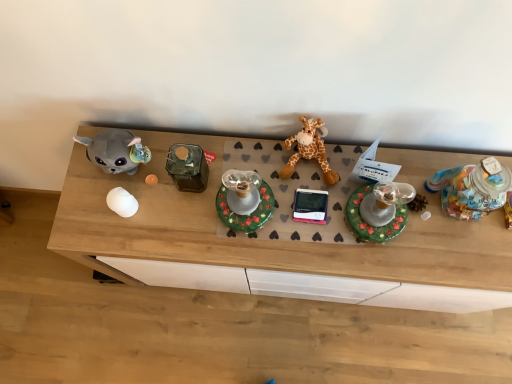
This screenshot has height=384, width=512. Find the location of `wooden desk at center`. wooden desk at center is located at coordinates (280, 241).

The width and height of the screenshot is (512, 384). Find the location of `white glossy egg at center, which is the first toy from left to right`. white glossy egg at center, which is the first toy from left to right is located at coordinates (122, 202).

Identify the location of orange plush giraffe at center. Image resolution: width=512 pixels, height=384 pixels. coord(309,149).

This screenshot has height=384, width=512. Describe the element at coordinates (378, 212) in the screenshot. I see `shiny green plastic candle holder at center, which is the 3th toy from left to right` at that location.

What is the approximate height of shiny green plastic candle holder at center, which is the 3th toy from left to right?

It is 7.92 inches.

I want to click on translucent plastic jar at right, positioned as the first toy in right-to-left order, so click(x=472, y=188).

Where is `wooden desk at center`? wooden desk at center is located at coordinates (280, 241).

Is translucent plastic jar at right, positioned as the first toy in right-to-left order, wider than shiny green plastic candle holder at center, which appears as the second toy when viewed from the right?

Yes, translucent plastic jar at right, positioned as the first toy in right-to-left order, is wider than shiny green plastic candle holder at center, which appears as the second toy when viewed from the right.

In the scene shown: Is translucent plastic jar at right, positioned as the fourth toy in left-to-right order, next to shiny green plastic candle holder at center, which is the 3th toy from left to right?

No, translucent plastic jar at right, positioned as the fourth toy in left-to-right order, is not next to shiny green plastic candle holder at center, which is the 3th toy from left to right.

In the image, is translucent plastic jar at right, positioned as the first toy in right-to-left order, on the left side or the right side of shiny green plastic candle holder at center, which is the 3th toy from left to right?

Based on their positions, translucent plastic jar at right, positioned as the first toy in right-to-left order, is located to the right of shiny green plastic candle holder at center, which is the 3th toy from left to right.

Identify the location of the 3rd toy positioned below the translucent plastic jar at right, positioned as the first toy in right-to-left order (from the image's perspective). (378, 212).

Between point (480, 196) and point (133, 201), which one is positioned in front?

Positioned in front is point (480, 196).

Can you tell me how much translucent plastic jar at right, positioned as the fourth toy in left-to-right order, and white glossy egg at center, which is the first toy from left to right, differ in facing direction?

translucent plastic jar at right, positioned as the fourth toy in left-to-right order, and white glossy egg at center, which is the first toy from left to right, are facing 0.000204 degrees away from each other.

Considering the relative sizes of translucent plastic jar at right, positioned as the first toy in right-to-left order, and white glossy egg at center, which is the first toy from left to right, in the image provided, is translucent plastic jar at right, positioned as the first toy in right-to-left order, thinner than white glossy egg at center, which is the first toy from left to right,?

No, translucent plastic jar at right, positioned as the first toy in right-to-left order, is not thinner than white glossy egg at center, which is the first toy from left to right.

From a real-world perspective, is translucent plastic jar at right, positioned as the first toy in right-to-left order, below white glossy egg at center, acting as the 4th toy starting from the right?

No, from a real-world perspective, translucent plastic jar at right, positioned as the first toy in right-to-left order, is not under white glossy egg at center, acting as the 4th toy starting from the right.

Do you think orange plush giraffe at center is within green matte candle holder at center, which is the third toy from right to left, or outside of it?

orange plush giraffe at center is not enclosed by green matte candle holder at center, which is the third toy from right to left.

Looking at this image, from the image's perspective, which one is positioned higher, orange plush giraffe at center or green matte candle holder at center, which is the third toy from right to left?

orange plush giraffe at center appears higher in the image.

From a real-world perspective, who is located higher, orange plush giraffe at center or green matte candle holder at center, which is the third toy from right to left?

green matte candle holder at center, which is the third toy from right to left, from a real-world perspective.

Based on the photo, can you confirm if orange plush giraffe at center is positioned to the left of green matte candle holder at center, placed as the second toy when sorted from left to right?

In fact, orange plush giraffe at center is to the right of green matte candle holder at center, placed as the second toy when sorted from left to right.

Does point (119, 205) come farther from viewer compared to point (342, 270)?

No, it is not.

Based on the photo, from a real-world perspective, who is located higher, white glossy egg at center, which is the first toy from left to right, or wooden desk at center?

white glossy egg at center, which is the first toy from left to right.

Looking at this image, is white glossy egg at center, which is the first toy from left to right, facing towards wooden desk at center?

No, white glossy egg at center, which is the first toy from left to right, is not aimed at wooden desk at center.

From the image's perspective, relative to green matte candle holder at center, which is the third toy from right to left, is shiny green plastic candle holder at center, which is the 3th toy from left to right, above or below?

shiny green plastic candle holder at center, which is the 3th toy from left to right, is below green matte candle holder at center, which is the third toy from right to left.

Does shiny green plastic candle holder at center, which appears as the second toy when viewed from the right, have a lesser height compared to green matte candle holder at center, placed as the second toy when sorted from left to right?

In fact, shiny green plastic candle holder at center, which appears as the second toy when viewed from the right, may be taller than green matte candle holder at center, placed as the second toy when sorted from left to right.

Considering the positions of points (390, 207) and (258, 196), is point (390, 207) farther from camera compared to point (258, 196)?

No, (390, 207) is closer to viewer.

From a real-world perspective, which is physically below, green matte candle holder at center, placed as the second toy when sorted from left to right, or translucent plastic jar at right, positioned as the fourth toy in left-to-right order?

green matte candle holder at center, placed as the second toy when sorted from left to right, from a real-world perspective.

Looking at this image, based on their sizes in the image, would you say green matte candle holder at center, which is the third toy from right to left, is bigger or smaller than translucent plastic jar at right, positioned as the first toy in right-to-left order?

Considering their sizes, green matte candle holder at center, which is the third toy from right to left, takes up less space than translucent plastic jar at right, positioned as the first toy in right-to-left order.

In terms of width, does green matte candle holder at center, which is the third toy from right to left, look wider or thinner when compared to translucent plastic jar at right, positioned as the first toy in right-to-left order?

In the image, green matte candle holder at center, which is the third toy from right to left, appears to be more narrow than translucent plastic jar at right, positioned as the first toy in right-to-left order.

Considering the relative sizes of shiny green plastic candle holder at center, which is the 3th toy from left to right, and translucent plastic jar at right, positioned as the fourth toy in left-to-right order, in the image provided, is shiny green plastic candle holder at center, which is the 3th toy from left to right, thinner than translucent plastic jar at right, positioned as the fourth toy in left-to-right order,?

Indeed, shiny green plastic candle holder at center, which is the 3th toy from left to right, has a lesser width compared to translucent plastic jar at right, positioned as the fourth toy in left-to-right order.

Do you think shiny green plastic candle holder at center, which is the 3th toy from left to right, is within translucent plastic jar at right, positioned as the first toy in right-to-left order, or outside of it?

shiny green plastic candle holder at center, which is the 3th toy from left to right, is not inside translucent plastic jar at right, positioned as the first toy in right-to-left order, it's outside.

Is shiny green plastic candle holder at center, which appears as the second toy when viewed from the right, far away from translucent plastic jar at right, positioned as the fourth toy in left-to-right order?

No.

From a real-world perspective, is shiny green plastic candle holder at center, which is the 3th toy from left to right, beneath translucent plastic jar at right, positioned as the first toy in right-to-left order?

Correct, in the physical world, shiny green plastic candle holder at center, which is the 3th toy from left to right, is lower than translucent plastic jar at right, positioned as the first toy in right-to-left order.

Where is `toy on the right of the shiny green plastic candle holder at center, which appears as the second toy when viewed from the right`? This screenshot has width=512, height=384. toy on the right of the shiny green plastic candle holder at center, which appears as the second toy when viewed from the right is located at coordinates (472, 188).

Which toy is the 3rd one when counting from the front of the white glossy egg at center, acting as the 4th toy starting from the right? Please provide its 2D coordinates.

[(472, 188)]

Which object lies nearer to the anchor point wooden desk at center, green matte candle holder at center, which is the third toy from right to left, or shiny green plastic candle holder at center, which is the 3th toy from left to right?

Based on the image, green matte candle holder at center, which is the third toy from right to left, appears to be nearer to wooden desk at center.

Based on their spatial positions, is translucent plastic jar at right, positioned as the first toy in right-to-left order, or orange plush giraffe at center further from wooden desk at center?

translucent plastic jar at right, positioned as the first toy in right-to-left order, is further to wooden desk at center.

Which object lies nearer to the anchor point white glossy egg at center, which is the first toy from left to right, orange plush giraffe at center or wooden desk at center?

orange plush giraffe at center is positioned closer to the anchor white glossy egg at center, which is the first toy from left to right.

Estimate the real-world distances between objects in this image. Which object is further from white glossy egg at center, which is the first toy from left to right, green matte candle holder at center, placed as the second toy when sorted from left to right, or shiny green plastic candle holder at center, which is the 3th toy from left to right?

shiny green plastic candle holder at center, which is the 3th toy from left to right, lies further to white glossy egg at center, which is the first toy from left to right, than the other object.

Which object lies nearer to the anchor point green matte candle holder at center, which is the third toy from right to left, shiny green plastic candle holder at center, which is the 3th toy from left to right, or white glossy egg at center, acting as the 4th toy starting from the right?

Among the two, shiny green plastic candle holder at center, which is the 3th toy from left to right, is located nearer to green matte candle holder at center, which is the third toy from right to left.

Based on their spatial positions, is translucent plastic jar at right, positioned as the fourth toy in left-to-right order, or orange plush giraffe at center closer to green matte candle holder at center, placed as the second toy when sorted from left to right?

orange plush giraffe at center is positioned closer to the anchor green matte candle holder at center, placed as the second toy when sorted from left to right.

Based on their spatial positions, is shiny green plastic candle holder at center, which is the 3th toy from left to right, or translucent plastic jar at right, positioned as the fourth toy in left-to-right order, closer to white glossy egg at center, acting as the 4th toy starting from the right?

Among the two, shiny green plastic candle holder at center, which is the 3th toy from left to right, is located nearer to white glossy egg at center, acting as the 4th toy starting from the right.

Considering their positions, is wooden desk at center positioned closer to shiny green plastic candle holder at center, which appears as the second toy when viewed from the right, than translucent plastic jar at right, positioned as the first toy in right-to-left order?

Based on the image, translucent plastic jar at right, positioned as the first toy in right-to-left order, appears to be nearer to shiny green plastic candle holder at center, which appears as the second toy when viewed from the right.

Find the location of a particular element. desk between orange plush giraffe at center and translucent plastic jar at right, positioned as the first toy in right-to-left order, from left to right is located at coordinates click(x=280, y=241).

Locate an element on the screen. This screenshot has height=384, width=512. toy situated between wooden desk at center and translucent plastic jar at right, positioned as the fourth toy in left-to-right order, from left to right is located at coordinates (378, 212).

Identify the location of toy between green matte candle holder at center, which is the third toy from right to left, and translucent plastic jar at right, positioned as the first toy in right-to-left order. The image size is (512, 384). (378, 212).

Where is `giraffe situated between green matte candle holder at center, placed as the second toy when sorted from left to right, and translucent plastic jar at right, positioned as the fourth toy in left-to-right order, from left to right`? giraffe situated between green matte candle holder at center, placed as the second toy when sorted from left to right, and translucent plastic jar at right, positioned as the fourth toy in left-to-right order, from left to right is located at coordinates (309, 149).